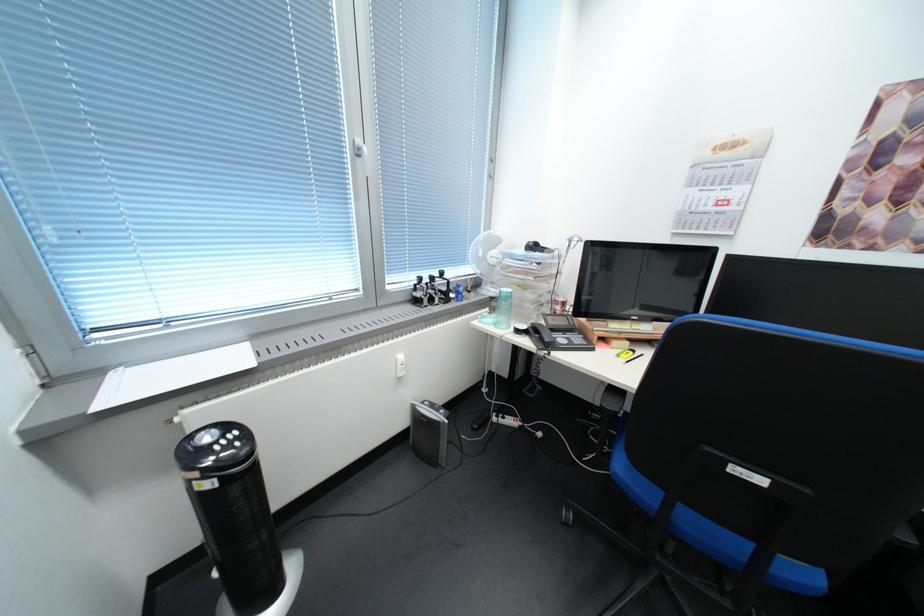
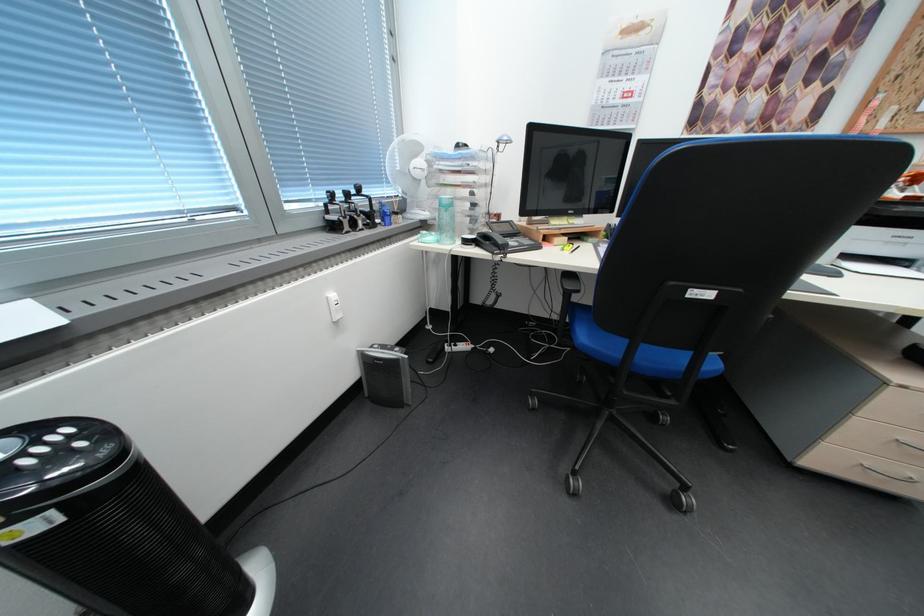
Locate, in the second image, the point that corresponds to pixel 225 432 in the first image.

(15, 443)